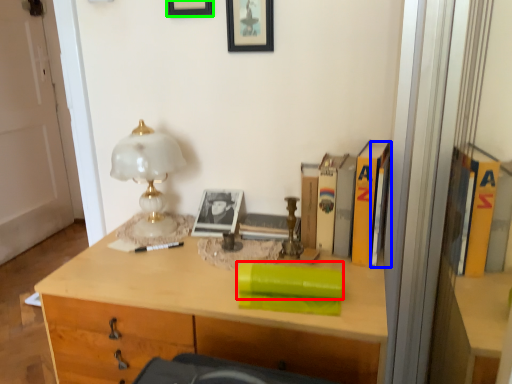
Question: Which object is positioned farthest from book (highlighted by a red box)? Select from book (highlighted by a blue box) and picture frame (highlighted by a green box).

Choices:
 (A) book
 (B) picture frame

Answer: (B)